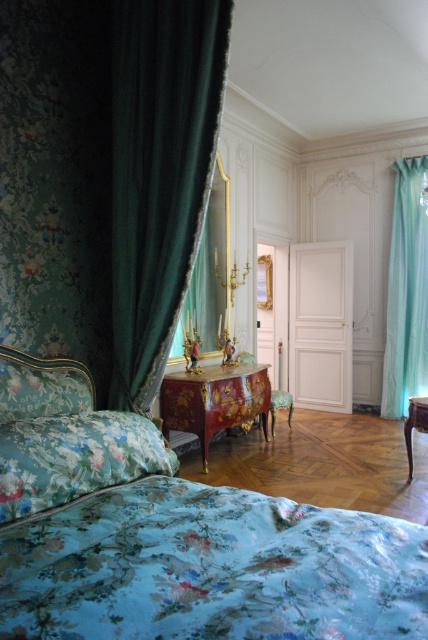
How far apart are floral fabric pillow at lower left and light blue sheer curtain at right?

A distance of 16.10 feet exists between floral fabric pillow at lower left and light blue sheer curtain at right.

Does floral fabric pillow at lower left have a larger size compared to light blue sheer curtain at right?

Actually, floral fabric pillow at lower left might be smaller than light blue sheer curtain at right.

Is point (35, 499) positioned after point (419, 320)?

No, it is not.

You are a GUI agent. You are given a task and a screenshot of the screen. Output one action in this format:
    pyautogui.click(x=<x>, y=<y>)
    Task: Click on the floral fabric pillow at lower left
    
    Given the screenshot: What is the action you would take?
    pyautogui.click(x=74, y=458)

Is velvet dark green curtain at left below light blue sheer curtain at right?

No.

Who is shorter, velvet dark green curtain at left or light blue sheer curtain at right?

velvet dark green curtain at left

What are the coordinates of `velvet dark green curtain at left` in the screenshot? It's located at (158, 173).

Locate an element on the screen. This screenshot has height=640, width=428. velvet dark green curtain at left is located at coordinates (158, 173).

Is point (68, 618) behind point (157, 470)?

No, it is in front of (157, 470).

Does floral fabric bed at lower left have a greater width compared to floral fabric pillow at lower left?

Correct, the width of floral fabric bed at lower left exceeds that of floral fabric pillow at lower left.

Does point (383, 620) lie behind point (101, 416)?

No, (383, 620) is in front of (101, 416).

You are a GUI agent. You are given a task and a screenshot of the screen. Output one action in this format:
    pyautogui.click(x=<x>, y=<y>)
    Task: Click on the floral fabric bed at lower left
    
    Given the screenshot: What is the action you would take?
    pyautogui.click(x=174, y=536)